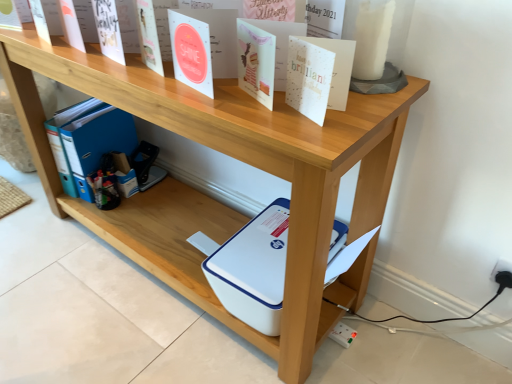
Identify the location of vacant space to the left of white paper at upper center, which is the 1th paperback book in bottom-to-top order. The height and width of the screenshot is (384, 512). (244, 109).